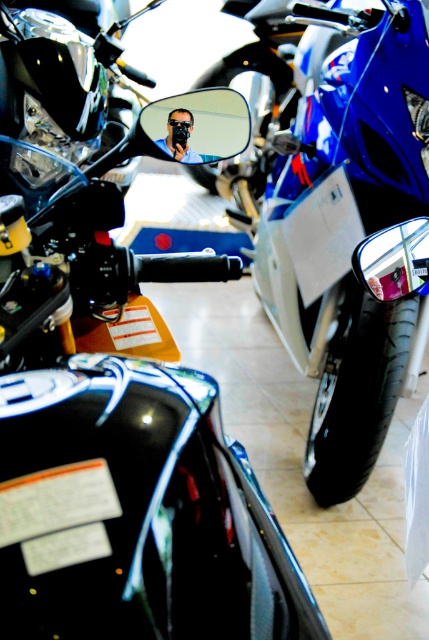
Looking at this image, between blue glossy motorcycle at center and matte black face mask at center, which one appears on the right side from the viewer's perspective?

Positioned to the right is blue glossy motorcycle at center.

Between point (323, 61) and point (174, 147), which one is positioned in front?

Point (174, 147) is more forward.

This screenshot has width=429, height=640. Find the location of `blue glossy motorcycle at center`. blue glossy motorcycle at center is located at coordinates (353, 243).